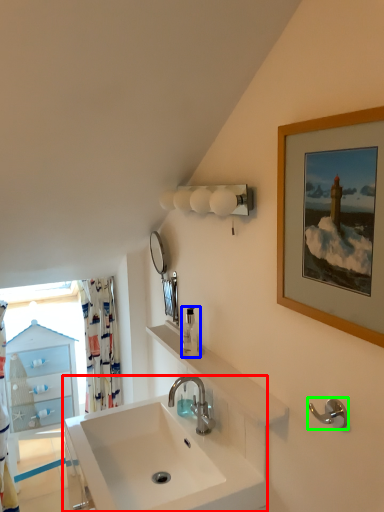
Question: Which object is the closest to the sink (highlighted by a red box)? Choose among these: soap dispenser (highlighted by a blue box) or towel bar (highlighted by a green box).

Choices:
 (A) soap dispenser
 (B) towel bar

Answer: (A)